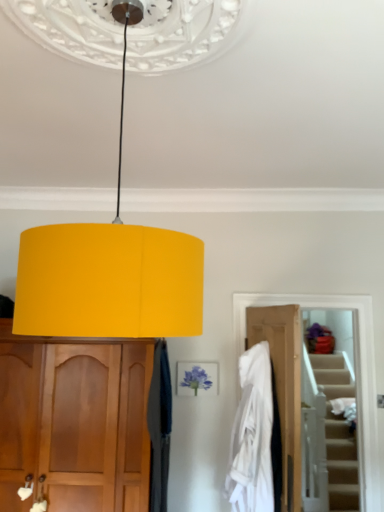
Question: Considering the positions of velvet dark blue curtain at center and white fabric at center in the image, is velvet dark blue curtain at center taller or shorter than white fabric at center?

Choices:
 (A) short
 (B) tall

Answer: (B)

Question: Is point (150, 500) closer or farther from the camera than point (240, 480)?

Choices:
 (A) closer
 (B) farther

Answer: (B)

Question: Which is nearer to the wooden door at lower right?

Choices:
 (A) velvet dark blue curtain at center
 (B) matte wood cabinet at left
 (C) matte yellow lampshade at center
 (D) white fabric at center

Answer: (D)

Question: Estimate the real-world distances between objects in this image. Which object is closer to the velvet dark blue curtain at center?

Choices:
 (A) matte wood cabinet at left
 (B) matte yellow lampshade at center
 (C) wooden door at lower right
 (D) white fabric at center

Answer: (A)